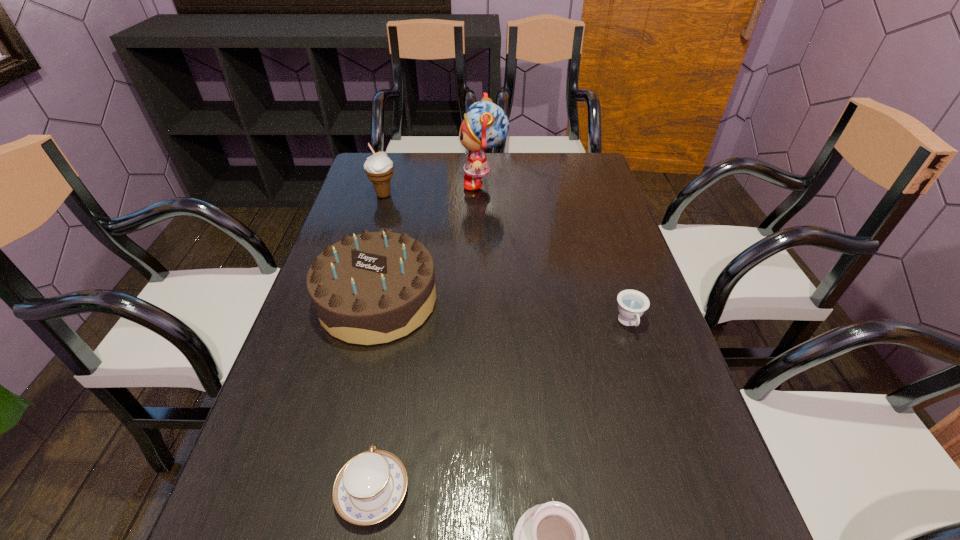
You are a GUI agent. You are given a task and a screenshot of the screen. Output one action in this format:
    pyautogui.click(x=<x>, y=<y>)
    Task: Click on the teacup identified as the second closest to the rightmost object
    
    Given the screenshot: What is the action you would take?
    pyautogui.click(x=370, y=486)

At what (x,y) coordinates should I click in order to perform the action: click on blank space that satisfies the following two spatial constraints: 1. on the face of the doll; 2. on the front-facing side of the birthday cake. Please return your answer as a coordinate pair (x, y). Looking at the image, I should click on (485, 300).

The height and width of the screenshot is (540, 960). What are the coordinates of `free space in the image that satisfies the following two spatial constraints: 1. on the face of the doll; 2. on the front-facing side of the birthday cake` in the screenshot? It's located at (485, 300).